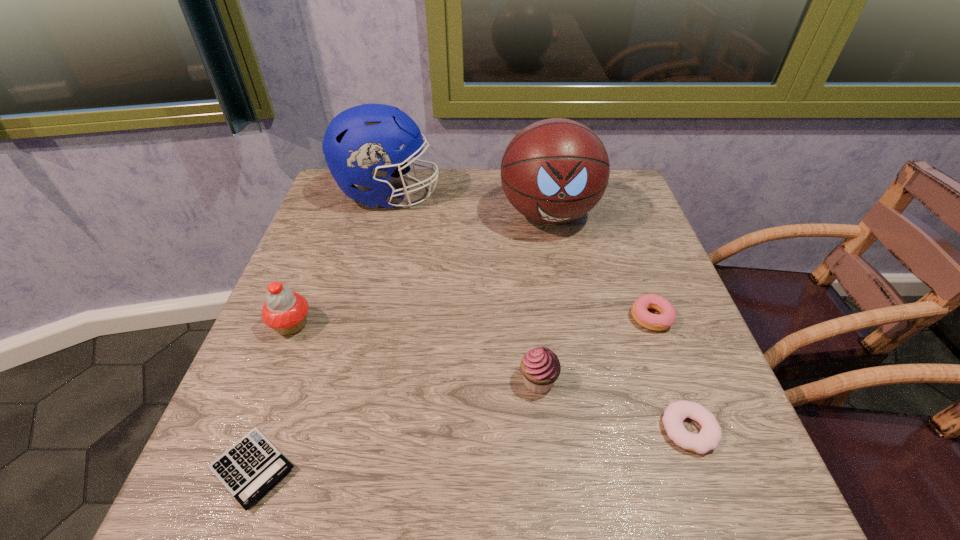
Locate an element on the screen. basketball is located at coordinates (554, 171).

Where is `football helmet`? Image resolution: width=960 pixels, height=540 pixels. football helmet is located at coordinates [361, 145].

Where is `the third tallest object`? the third tallest object is located at coordinates (285, 311).

Identify the location of the left cupcake. The width and height of the screenshot is (960, 540). (285, 311).

This screenshot has width=960, height=540. In order to click on the fourth shortest object in this screenshot , I will do `click(540, 367)`.

Where is `the shorter cupcake`? This screenshot has width=960, height=540. the shorter cupcake is located at coordinates (540, 367).

Find the location of a particular element. The image size is (960, 540). the fifth tallest object is located at coordinates (666, 318).

Where is `the farther doughnut`? The width and height of the screenshot is (960, 540). the farther doughnut is located at coordinates (666, 318).

At what (x,y) coordinates should I click in order to perform the action: click on the shorter doughnut. Please return your answer as a coordinate pair (x, y). This screenshot has width=960, height=540. Looking at the image, I should click on (710, 435).

I want to click on the nearer doughnut, so click(x=710, y=435).